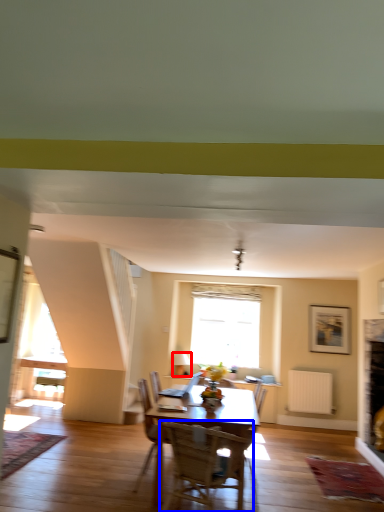
Question: Which of the following is the closest to the observer, lamp (highlighted by a red box) or chair (highlighted by a blue box)?

Choices:
 (A) lamp
 (B) chair

Answer: (B)